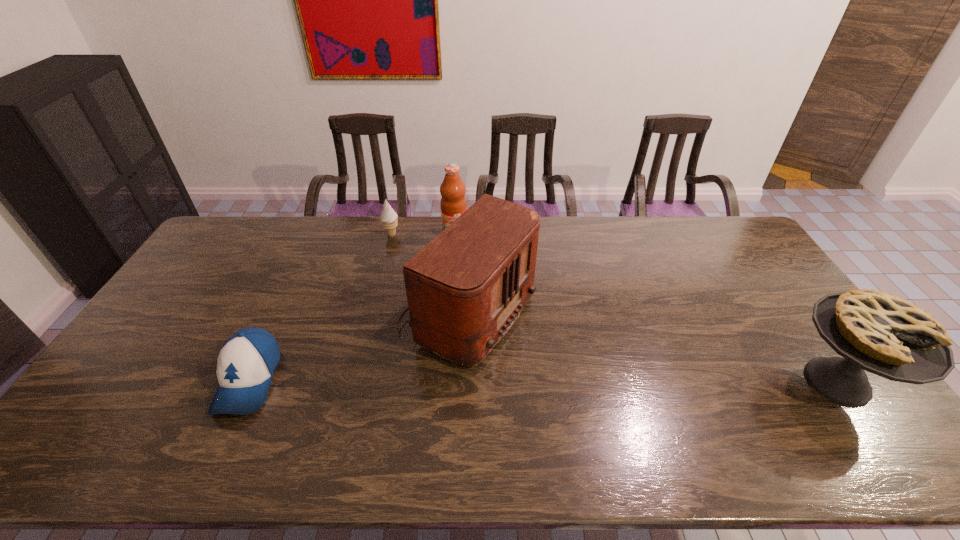
Locate an element on the screen. Image resolution: width=960 pixels, height=540 pixels. free space located 0.180m on the front panel of the radio receiver is located at coordinates (586, 370).

Identify the location of free space located on the front panel of the radio receiver. Image resolution: width=960 pixels, height=540 pixels. (592, 373).

Find the location of a particular element. free space located 0.130m on the front panel of the radio receiver is located at coordinates (568, 362).

Image resolution: width=960 pixels, height=540 pixels. I want to click on free location located on the front-facing side of the icecream, so [444, 305].

I want to click on vacant space located 0.240m on the front-facing side of the icecream, so click(x=422, y=276).

You are a GUI agent. You are given a task and a screenshot of the screen. Output one action in this format:
    pyautogui.click(x=<x>, y=<y>)
    Task: Click on the vacant space located 0.230m on the front-facing side of the icecream
    The height and width of the screenshot is (540, 960).
    Given the screenshot: What is the action you would take?
    pyautogui.click(x=421, y=274)

Locate an element on the screen. fruit juice positioned at the far edge is located at coordinates (453, 203).

At what (x,y) coordinates should I click in order to perform the action: click on icecream located at the far edge. Please return your answer as a coordinate pair (x, y). This screenshot has height=540, width=960. Looking at the image, I should click on (389, 217).

I want to click on baseball cap that is at the near edge, so pyautogui.click(x=247, y=361).

The image size is (960, 540). Identify the location of pie that is positioned at the near edge. (875, 331).